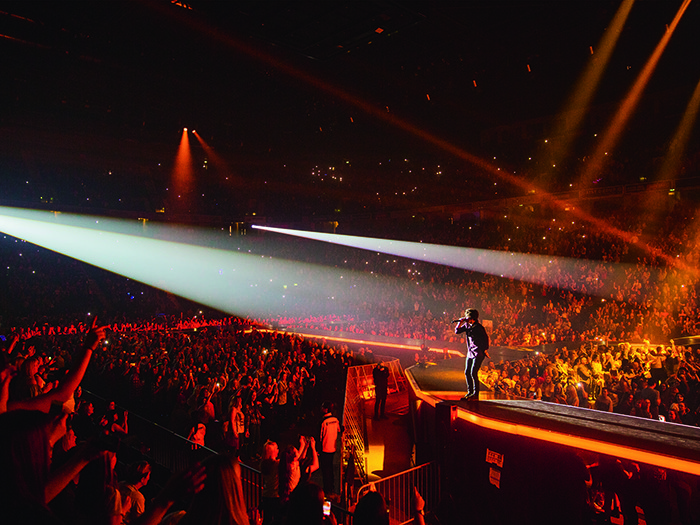
This screenshot has width=700, height=525. I want to click on lights, so click(71, 236), click(199, 268), click(321, 306), click(374, 245), click(449, 254), click(528, 267).